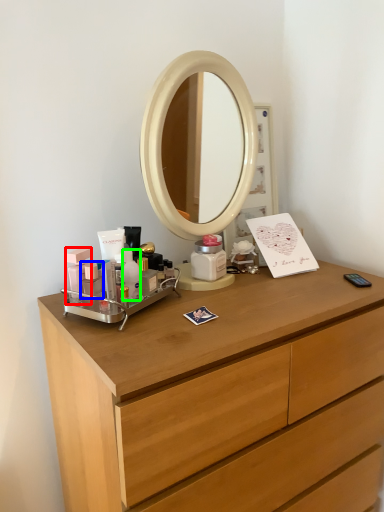
Question: Which object is the farthest from toiletry (highlighted by a red box)? Choose among these: toiletry (highlighted by a blue box) or toiletry (highlighted by a green box).

Choices:
 (A) toiletry
 (B) toiletry

Answer: (B)